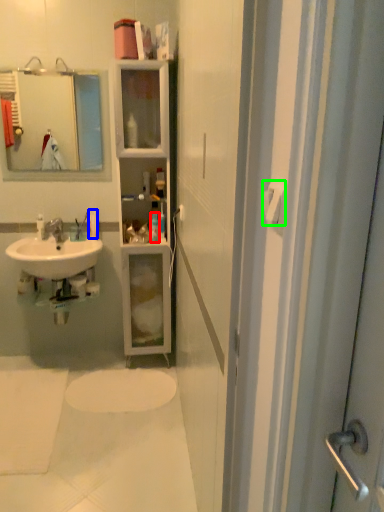
Question: Based on their relative distances, which object is farther from toiletry (highlighted by a red box)? Choose from toiletry (highlighted by a blue box) and towel bar (highlighted by a green box).

Choices:
 (A) toiletry
 (B) towel bar

Answer: (B)